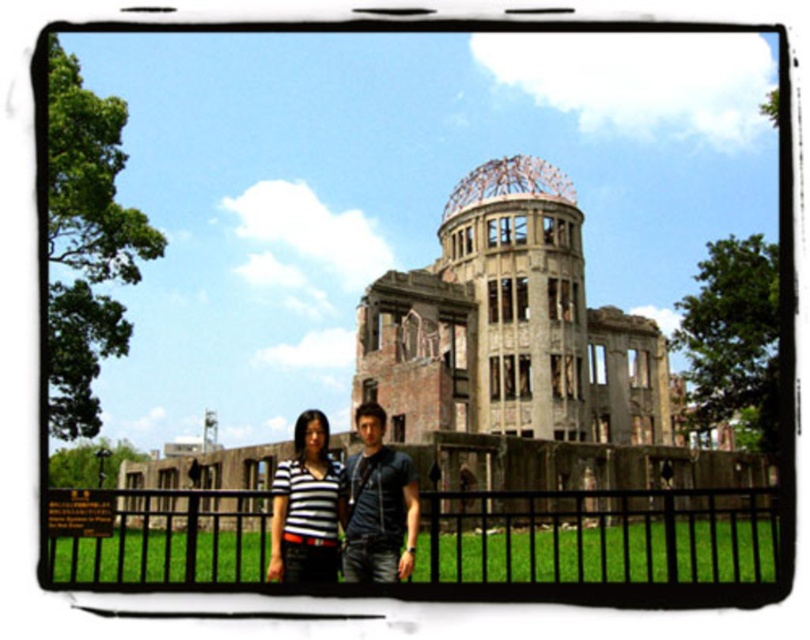
You are visiting the Atomic Bomb Dome and want to take a photo of the striped fabric shirt at center and the black metal fence at lower center. Which object is taller in the photo?

The striped fabric shirt at center is taller than the black metal fence at lower center.

You are standing at the historical site of the Atomic Bomb Dome in Hiroshima. You notice two points marked on the ground. The first point is at coordinates point (190,576), and the second point is at point (335,538). If you want to reach the point that is closer to you, which one should you walk towards?

You should walk towards point (190,576) because it is closer to the camera than point (335,538).